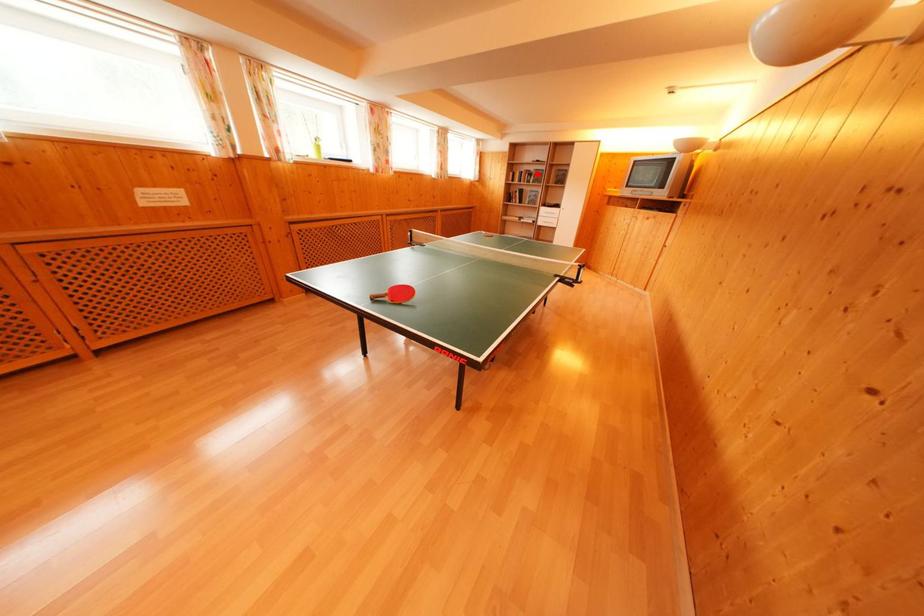
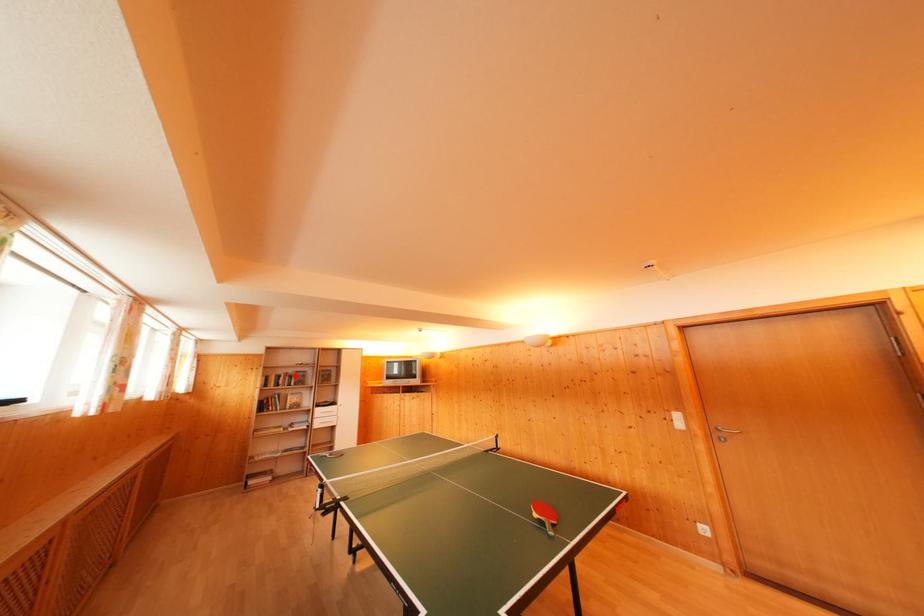
I am providing you with two images of the same scene from different viewpoints. A red point is marked on the first image and another point is marked on the second image. Is the marked point in image1 the same physical position as the marked point in image2?

Yes